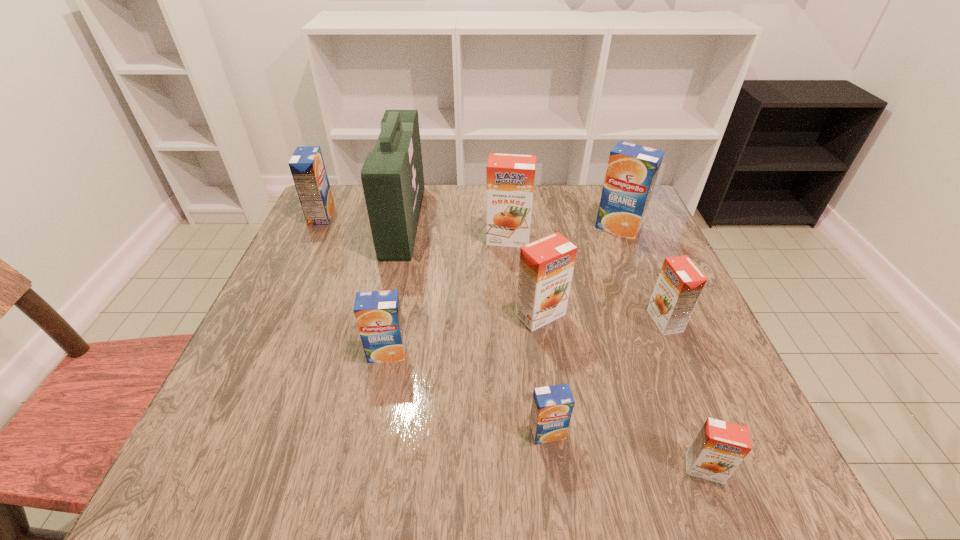
Identify the location of free region located on the left of the smallest blue orange_juice. This screenshot has width=960, height=540. (342, 433).

Identify the location of free space located on the back of the nearest object. The width and height of the screenshot is (960, 540). tap(650, 326).

The image size is (960, 540). I want to click on the first-aid kit situated at the far edge, so click(x=392, y=177).

Locate an element on the screen. The height and width of the screenshot is (540, 960). object situated at the left edge is located at coordinates (307, 167).

Identify the location of object that is at the far left corner. (307, 167).

I want to click on object at the far right corner, so click(632, 170).

You are a GUI agent. You are given a task and a screenshot of the screen. Output one action in this format:
    pyautogui.click(x=<x>, y=<y>)
    Task: Click on the object located at the near right corner
    This screenshot has height=540, width=960.
    Given the screenshot: What is the action you would take?
    pyautogui.click(x=718, y=449)

Where is `free spot at the far edge of the desktop`? This screenshot has width=960, height=540. free spot at the far edge of the desktop is located at coordinates (436, 213).

This screenshot has width=960, height=540. Identify the location of vacant region at the left edge of the desktop. (272, 427).

The image size is (960, 540). Identify the location of free space that is in between the nearest blue orange_juice and the farthest orange orange juice. pyautogui.click(x=527, y=335).